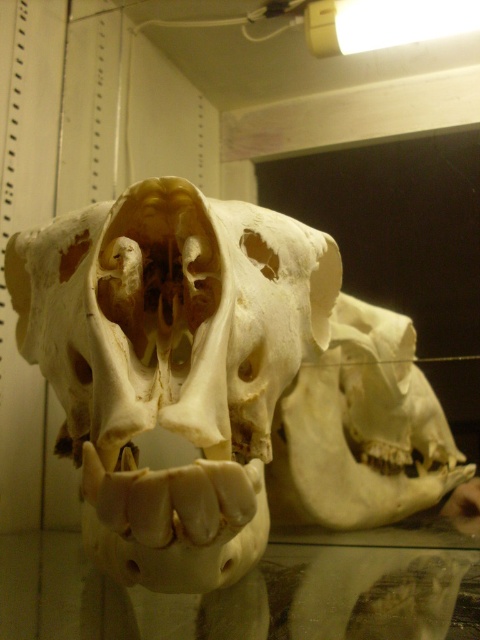
Is white bone skull at center to the right of white matte skull at center from the viewer's perspective?

Incorrect, white bone skull at center is not on the right side of white matte skull at center.

Is point (153, 509) positioned before point (342, 456)?

Yes, it is.

Locate an element on the screen. This screenshot has width=480, height=640. white bone skull at center is located at coordinates (171, 365).

Does white bone skull at center appear on the left side of transparent glass table at lower center?

Yes, white bone skull at center is to the left of transparent glass table at lower center.

What are the coordinates of `white bone skull at center` in the screenshot? It's located at (171, 365).

Is point (238, 440) farther from camera compared to point (19, 554)?

No, it is in front of (19, 554).

Where is `white bone skull at center`? The height and width of the screenshot is (640, 480). white bone skull at center is located at coordinates (171, 365).

Can you confirm if transparent glass table at lower center is positioned to the left of white matte skull at center?

Indeed, transparent glass table at lower center is positioned on the left side of white matte skull at center.

Find the location of a particular element. The width and height of the screenshot is (480, 640). transparent glass table at lower center is located at coordinates (251, 593).

Find the location of `transparent glass table at lower center`. transparent glass table at lower center is located at coordinates (251, 593).